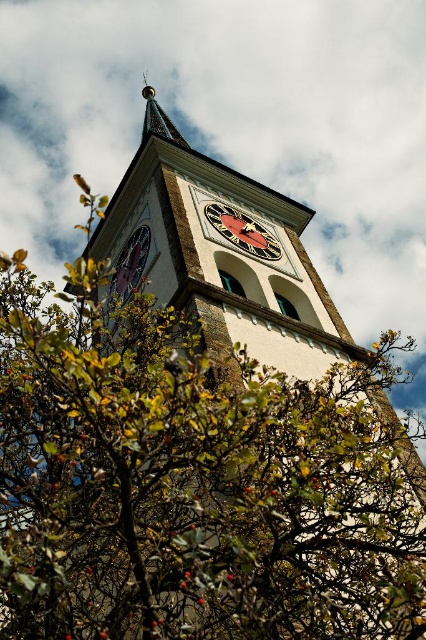
Does green leafy bush at lower center come in front of matte purple clock at center?

Yes, green leafy bush at lower center is closer to the viewer.

Who is more forward, (x=169, y=339) or (x=115, y=266)?

Point (x=169, y=339) is in front.

Which is in front, point (100, 376) or point (141, 262)?

Point (100, 376) is more forward.

Locate an element on the screen. green leafy bush at lower center is located at coordinates (192, 481).

Between green leafy bush at lower center and metallic clock face at center, which one appears on the right side from the viewer's perspective?

Positioned to the right is metallic clock face at center.

Does green leafy bush at lower center have a lesser height compared to metallic clock face at center?

In fact, green leafy bush at lower center may be taller than metallic clock face at center.

Which is behind, point (74, 467) or point (267, 257)?

The point (267, 257) is more distant.

The image size is (426, 640). Identify the location of green leafy bush at lower center. (192, 481).

Is metallic clock face at center smaller than gold metallic spire at upper center?

Indeed, metallic clock face at center has a smaller size compared to gold metallic spire at upper center.

Is point (215, 228) farther from camera compared to point (152, 108)?

That is False.

Who is more distant from viewer, [230,227] or [146,81]?

The point [146,81] is more distant.

This screenshot has width=426, height=640. I want to click on metallic clock face at center, so click(x=242, y=230).